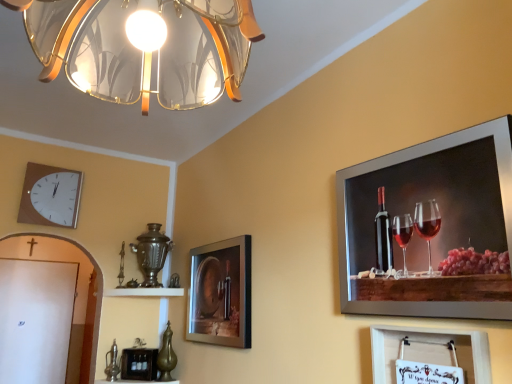
Question: Which direction should I rotate to look at translucent glass lampshade at upper center?

Choices:
 (A) left
 (B) right

Answer: (A)

Question: Is metallic silver picture frame at upper right, which ranks as the second picture frame in right-to-left order, facing away from white glossy shelf at center?

Choices:
 (A) yes
 (B) no

Answer: (B)

Question: Is metallic silver picture frame at upper right, acting as the 4th picture frame starting from the back, aimed at white glossy shelf at center?

Choices:
 (A) no
 (B) yes

Answer: (A)

Question: Is metallic silver picture frame at upper right, which ranks as the second picture frame in right-to-left order, behind white glossy shelf at center?

Choices:
 (A) yes
 (B) no

Answer: (B)

Question: Would you say metallic silver picture frame at upper right, which ranks as the second picture frame in right-to-left order, is outside white glossy shelf at center?

Choices:
 (A) yes
 (B) no

Answer: (A)

Question: From the image's perspective, would you say metallic silver picture frame at upper right, marked as the first picture frame in a front-to-back arrangement, is positioned over white glossy shelf at center?

Choices:
 (A) yes
 (B) no

Answer: (A)

Question: Does metallic silver picture frame at upper right, the third picture frame viewed from the left, contain white glossy shelf at center?

Choices:
 (A) yes
 (B) no

Answer: (B)

Question: Is the position of white paper at lower right, arranged as the 3th picture frame when viewed from the back, less distant than that of matte glass picture frame at center, arranged as the second picture frame when viewed from the left?

Choices:
 (A) no
 (B) yes

Answer: (B)

Question: Is white paper at lower right, the 1th picture frame positioned from the right, oriented away from matte glass picture frame at center, the third picture frame when ordered from right to left?

Choices:
 (A) no
 (B) yes

Answer: (A)

Question: Is matte glass picture frame at center, arranged as the second picture frame when viewed from the left, located within white paper at lower right, which is counted as the 4th picture frame, starting from the left?

Choices:
 (A) yes
 (B) no

Answer: (B)

Question: Considering the relative sizes of white paper at lower right, arranged as the 3th picture frame when viewed from the back, and matte glass picture frame at center, which is the third picture frame in front-to-back order, in the image provided, is white paper at lower right, arranged as the 3th picture frame when viewed from the back, shorter than matte glass picture frame at center, which is the third picture frame in front-to-back order,?

Choices:
 (A) yes
 (B) no

Answer: (A)

Question: Is white paper at lower right, the 1th picture frame positioned from the right, facing towards matte glass picture frame at center, the third picture frame when ordered from right to left?

Choices:
 (A) no
 (B) yes

Answer: (A)

Question: From a real-world perspective, is white paper at lower right, arranged as the 3th picture frame when viewed from the back, on top of matte glass picture frame at center, the third picture frame when ordered from right to left?

Choices:
 (A) no
 (B) yes

Answer: (A)

Question: From the image's perspective, is translucent glass lampshade at upper center located beneath matte glass picture frame at center, which is the third picture frame in front-to-back order?

Choices:
 (A) no
 (B) yes

Answer: (A)